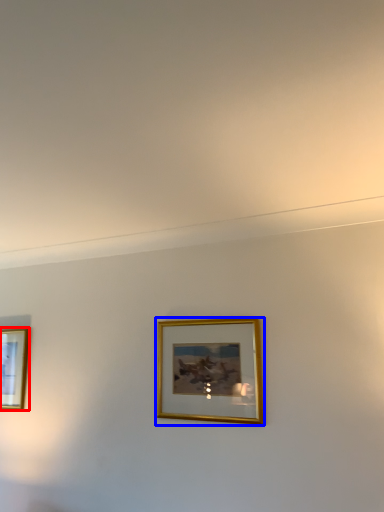
Question: Which object appears closest to the camera in this image, picture frame (highlighted by a red box) or picture frame (highlighted by a blue box)?

Choices:
 (A) picture frame
 (B) picture frame

Answer: (B)